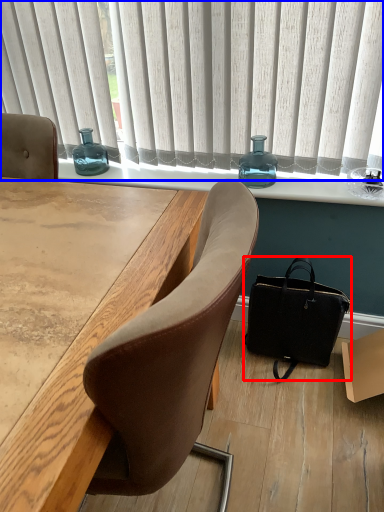
Question: Which of the following is the farthest to the observer, handbag (highlighted by a red box) or curtain (highlighted by a blue box)?

Choices:
 (A) handbag
 (B) curtain

Answer: (A)